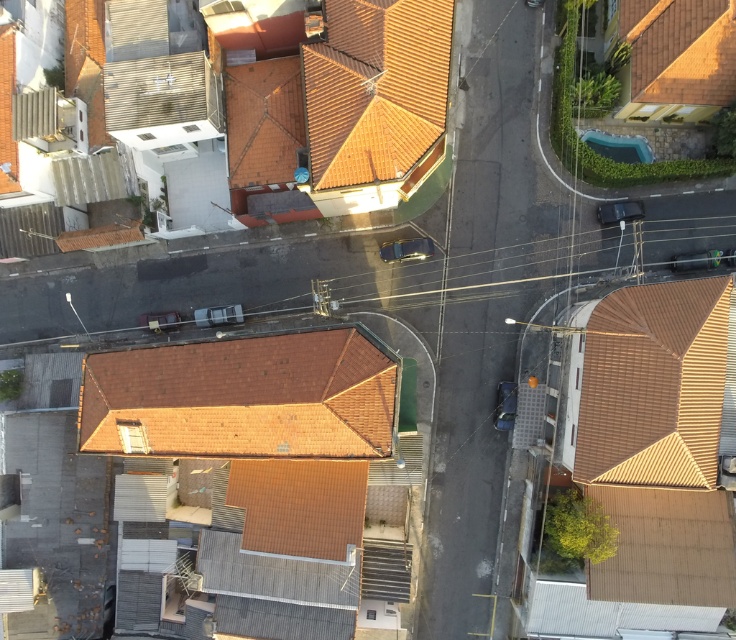
Between point (311, 365) and point (690, 403), which one is positioned behind?

Positioned behind is point (690, 403).

In the scene shown: Does brown tile roof at center have a larger size compared to brown tile roof at lower right?

Yes, brown tile roof at center is bigger than brown tile roof at lower right.

Locate an element on the screen. This screenshot has height=640, width=736. brown tile roof at center is located at coordinates (241, 397).

Is point (693, 296) farther from camera compared to point (394, 60)?

Yes, point (693, 296) is behind point (394, 60).

Is point (684, 340) farther from viewer compared to point (372, 166)?

No.

You are a GUI agent. You are given a task and a screenshot of the screen. Output one action in this format:
    pyautogui.click(x=<x>, y=<y>)
    Task: Click on the brown tile roof at lower right
    
    Given the screenshot: What is the action you would take?
    pyautogui.click(x=654, y=385)

Which of these two, brown tile roof at center or orange clay tiles at upper center, stands shorter?

Standing shorter between the two is orange clay tiles at upper center.

This screenshot has width=736, height=640. Find the location of `brown tile roof at center`. brown tile roof at center is located at coordinates (241, 397).

The width and height of the screenshot is (736, 640). Identify the location of brown tile roof at center. (241, 397).